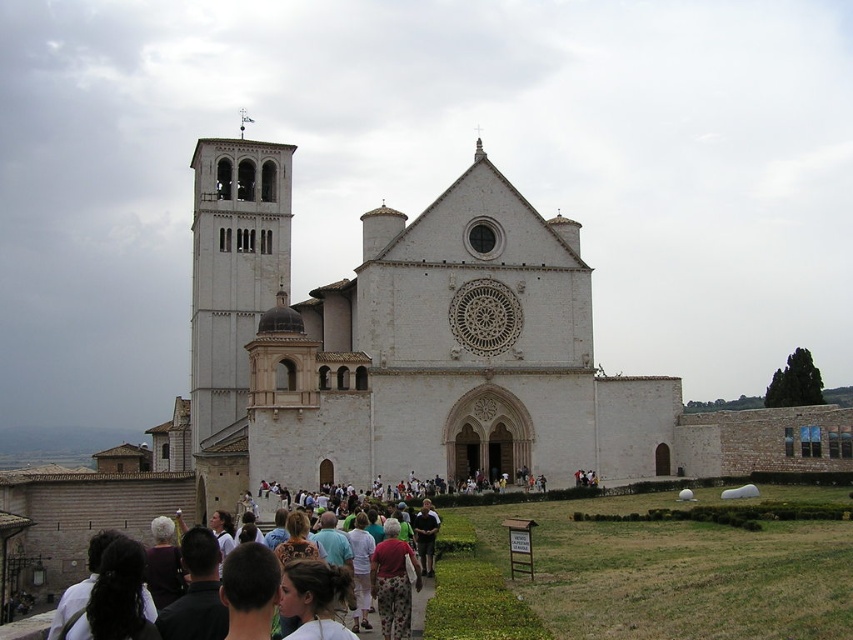
Question: Which of the following is the farthest from the observer?

Choices:
 (A) (238, 168)
 (B) (582, 285)

Answer: (A)

Question: Is white stone church at center above white stone bell tower at center-left?

Choices:
 (A) no
 (B) yes

Answer: (A)

Question: Among these objects, which one is nearest to the camera?

Choices:
 (A) white stone bell tower at center-left
 (B) white stone church at center

Answer: (B)

Question: Among these points, which one is nearest to the camera?

Choices:
 (A) (209, 272)
 (B) (386, 456)

Answer: (B)

Question: Can you confirm if white stone church at center is positioned below white stone bell tower at center-left?

Choices:
 (A) no
 (B) yes

Answer: (B)

Question: Is white stone church at center to the right of white stone bell tower at center-left from the viewer's perspective?

Choices:
 (A) yes
 (B) no

Answer: (A)